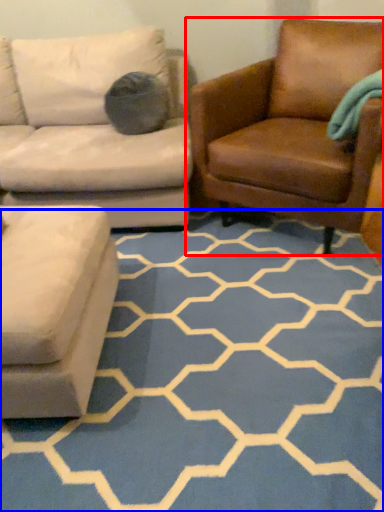
Question: Which of the following is the closest to the observer, chair (highlighted by a red box) or pattern (highlighted by a blue box)?

Choices:
 (A) chair
 (B) pattern

Answer: (B)